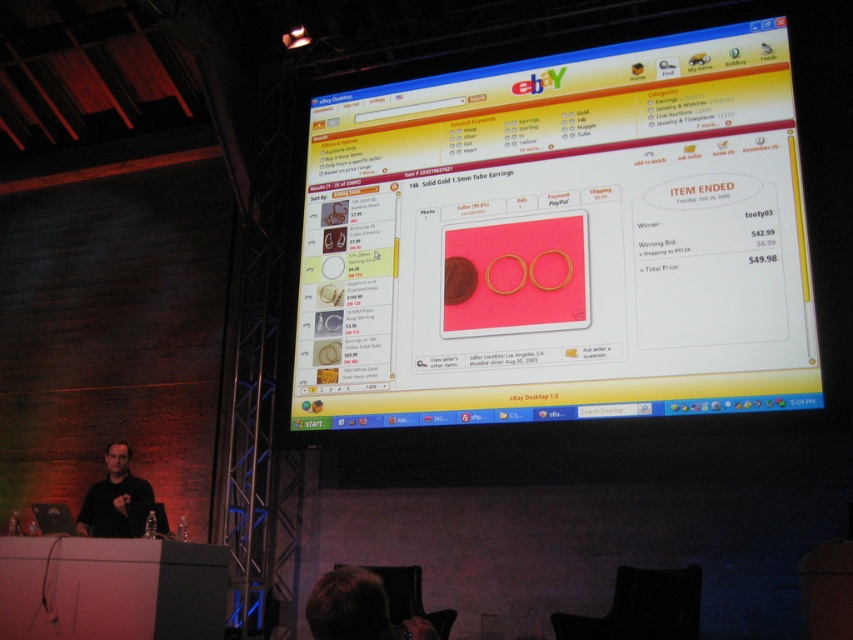
Looking at this image, between pink matte earrings at center and black matte shirt at lower left, which one has more height?

Standing taller between the two is pink matte earrings at center.

Is pink matte earrings at center behind black matte shirt at lower left?

No, pink matte earrings at center is in front of black matte shirt at lower left.

Image resolution: width=853 pixels, height=640 pixels. What are the coordinates of `pink matte earrings at center` in the screenshot? It's located at (560, 241).

Is dark brown hair at lower center wider than black matte shirt at lower left?

Incorrect, dark brown hair at lower center's width does not surpass black matte shirt at lower left's.

Consider the image. Between dark brown hair at lower center and black matte shirt at lower left, which one has more height?

black matte shirt at lower left is taller.

The image size is (853, 640). In order to click on dark brown hair at lower center in this screenshot , I will do `click(357, 609)`.

This screenshot has width=853, height=640. I want to click on dark brown hair at lower center, so click(357, 609).

Who is taller, pink matte earrings at center or dark brown hair at lower center?

With more height is pink matte earrings at center.

Does pink matte earrings at center have a larger size compared to dark brown hair at lower center?

Indeed, pink matte earrings at center has a larger size compared to dark brown hair at lower center.

Between point (416, 349) and point (383, 612), which one is positioned in front?

Point (383, 612) is more forward.

This screenshot has height=640, width=853. I want to click on pink matte earrings at center, so click(x=560, y=241).